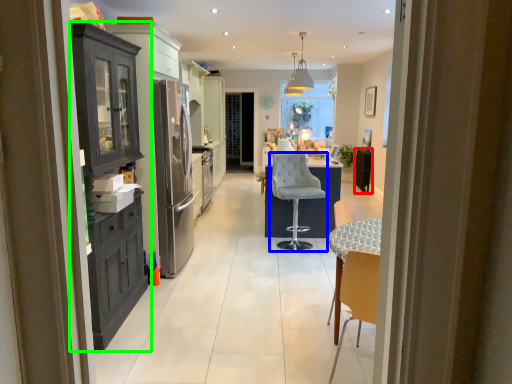
Question: Based on their relative distances, which object is farther from appliance (highlighted by a red box)? Choose from chair (highlighted by a blue box) and cabinetry (highlighted by a green box).

Choices:
 (A) chair
 (B) cabinetry

Answer: (B)